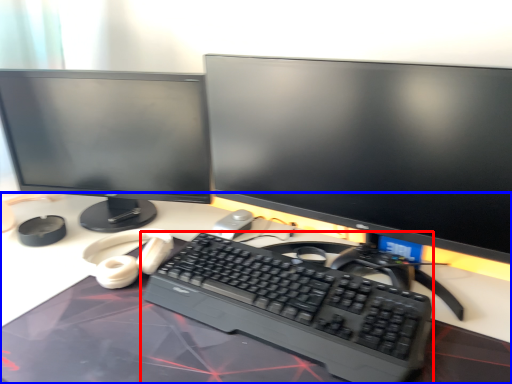
Question: Which object is closer to the camera taking this photo, computer keyboard (highlighted by a red box) or desk (highlighted by a blue box)?

Choices:
 (A) computer keyboard
 (B) desk

Answer: (B)